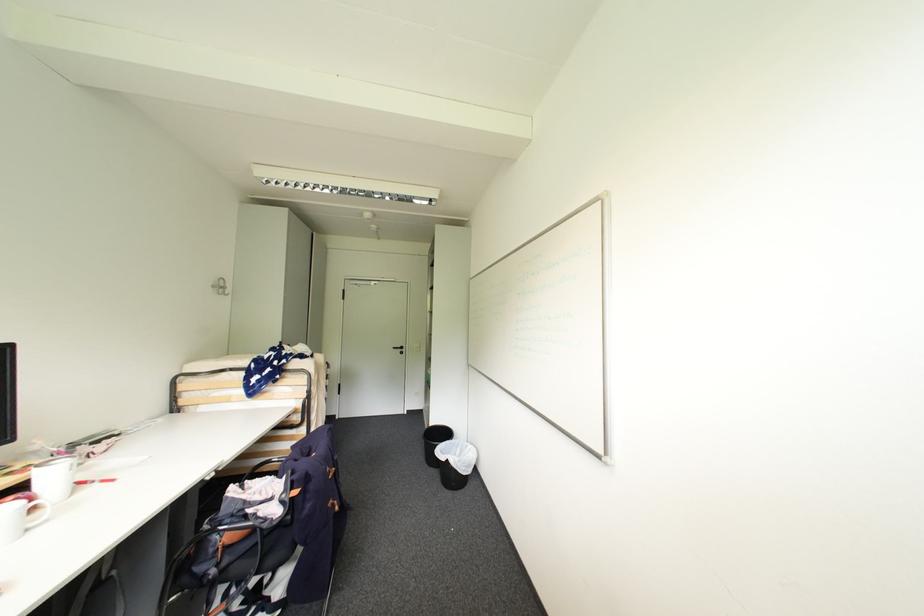
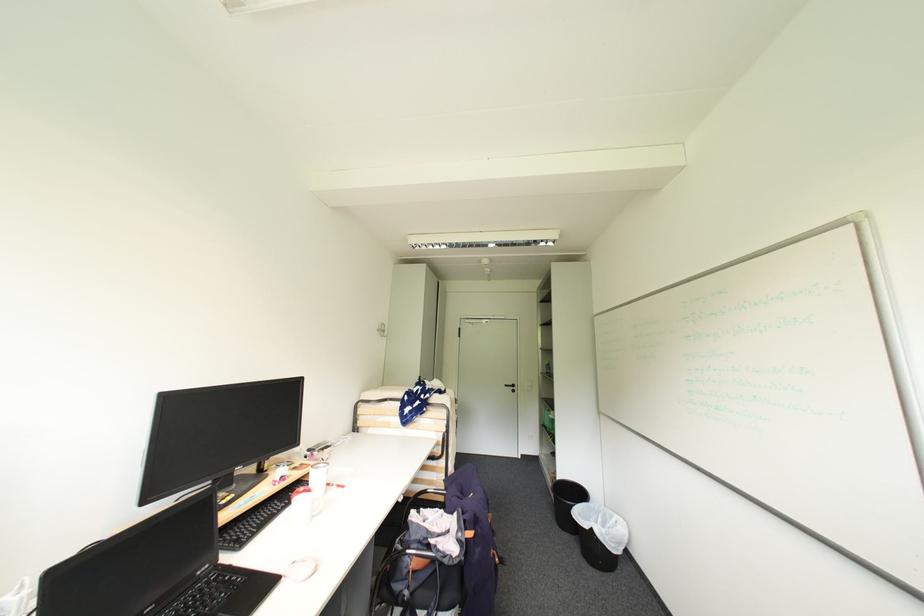
Question: The camera is either moving clockwise (left) or counter-clockwise (right) around the object. The first image is from the beginning of the video and the second image is from the end. Is the camera moving left or right when shooting the video?

Choices:
 (A) Left
 (B) Right

Answer: (B)